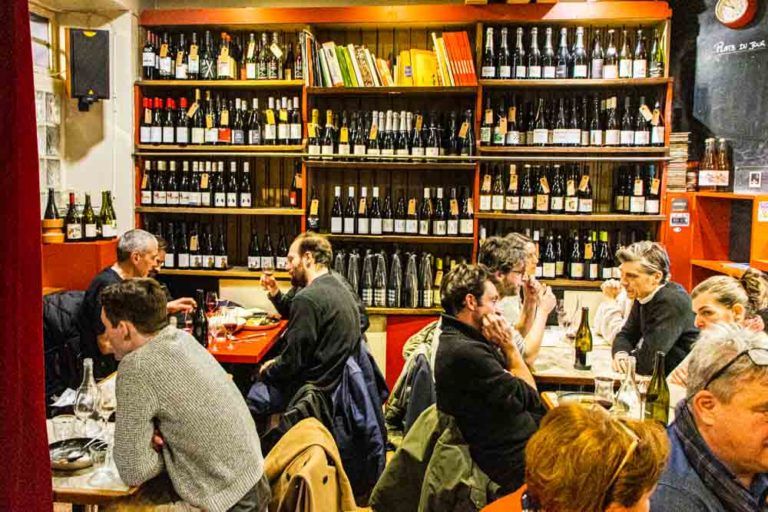
Identify the location of clock. The height and width of the screenshot is (512, 768). (740, 23).